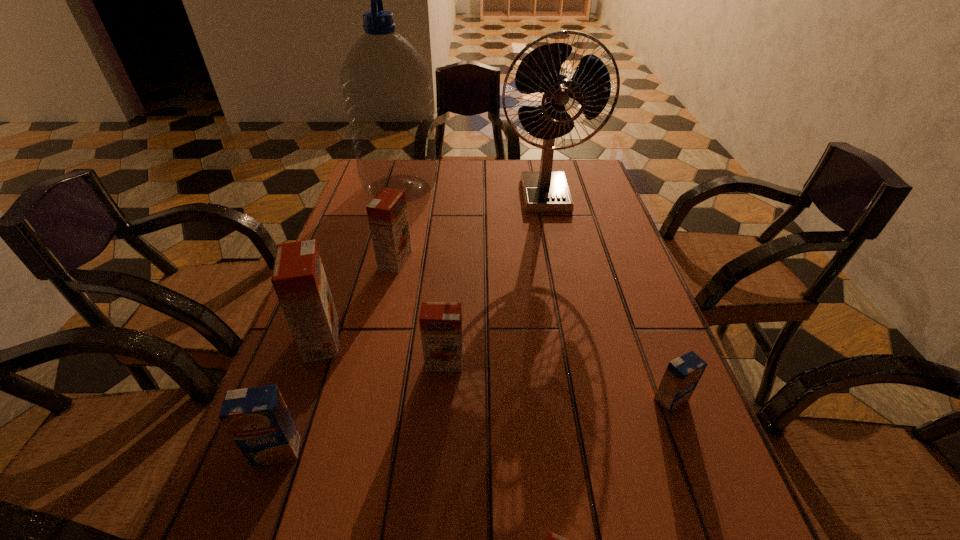
Where is `blue water jug`? The width and height of the screenshot is (960, 540). blue water jug is located at coordinates (386, 83).

You are a GUI agent. You are given a task and a screenshot of the screen. Output one action in this format:
    pyautogui.click(x=<x>, y=<y>)
    Task: Click on the blue fan
    The image size is (960, 540).
    Given the screenshot: What is the action you would take?
    pyautogui.click(x=545, y=191)

This screenshot has height=540, width=960. What are the coordinates of `the tallest orange juice` in the screenshot? It's located at [x=299, y=280].

Where is `the biggest orange orange juice`? This screenshot has width=960, height=540. the biggest orange orange juice is located at coordinates (299, 280).

At what (x,y) coordinates should I click in order to perform the action: click on the fifth shortest object. Please return your answer as a coordinate pair (x, y). This screenshot has width=960, height=540. Looking at the image, I should click on (387, 213).

The width and height of the screenshot is (960, 540). I want to click on the fifth shortest orange juice, so click(387, 213).

I want to click on the third orange orange juice from left to right, so click(440, 323).

Find the location of a particular element. the fourth object from right to left is located at coordinates (440, 323).

Locate an element on the screen. the nearer blue orange_juice is located at coordinates (258, 420).

At what (x,y) coordinates should I click in order to perform the action: click on the bigger blue orange_juice. Please return your answer as a coordinate pair (x, y). Image resolution: width=960 pixels, height=540 pixels. Looking at the image, I should click on (258, 420).